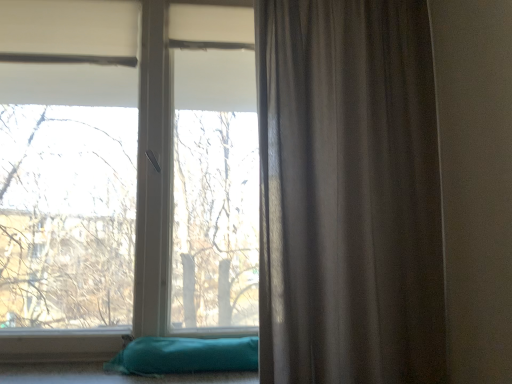
Question: Is satin gray curtain at right wider or thinner than teal fabric pillow at lower left?

Choices:
 (A) wide
 (B) thin

Answer: (B)

Question: From a real-world perspective, is satin gray curtain at right above or below teal fabric pillow at lower left?

Choices:
 (A) below
 (B) above

Answer: (B)

Question: Which is nearer to the satin gray curtain at right?

Choices:
 (A) teal fabric pillow at lower left
 (B) transparent glass window at center

Answer: (A)

Question: Which object is positioned farthest from the teal fabric pillow at lower left?

Choices:
 (A) transparent glass window at center
 (B) satin gray curtain at right

Answer: (A)